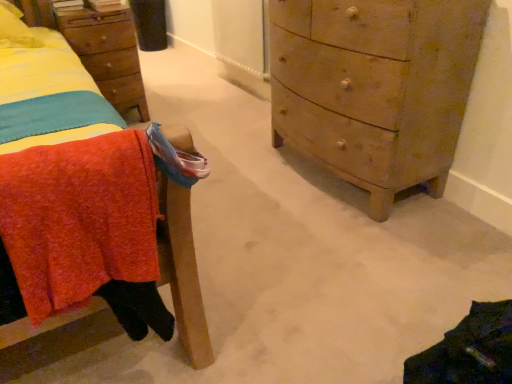
Question: In terms of width, does wooden nightstand at upper left look wider or thinner when compared to knitted wool blanket at left?

Choices:
 (A) wide
 (B) thin

Answer: (A)

Question: Is point click(123, 61) positioned closer to the camera than point click(8, 205)?

Choices:
 (A) closer
 (B) farther

Answer: (B)

Question: Which object is the closest to the knitted wool blanket at left?

Choices:
 (A) wooden chest of drawers at right
 (B) wooden nightstand at upper left

Answer: (B)

Question: Which object is positioned farthest from the wooden chest of drawers at right?

Choices:
 (A) knitted wool blanket at left
 (B) wooden nightstand at upper left

Answer: (B)